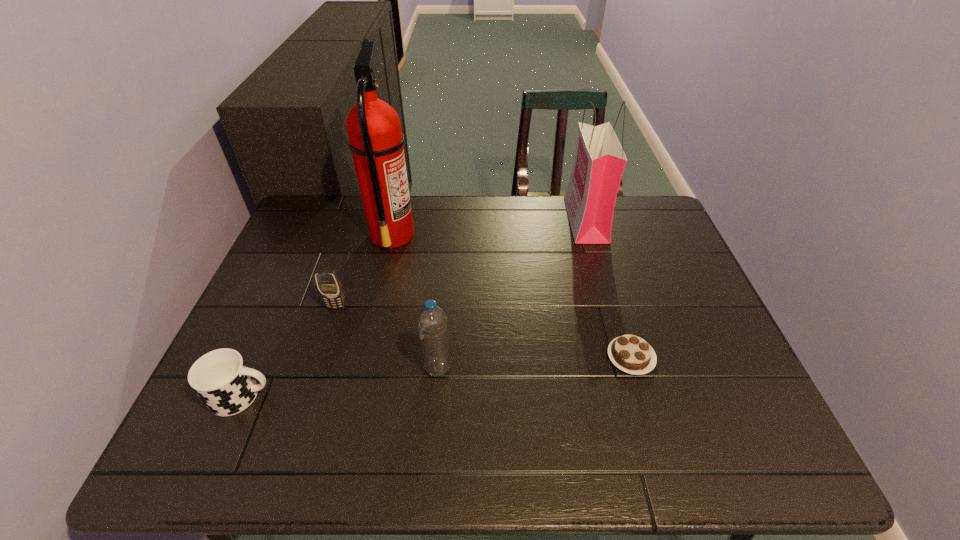
In order to click on object located in the left edge section of the desktop in this screenshot , I will do `click(221, 378)`.

This screenshot has height=540, width=960. What are the coordinates of `blank space at the far edge` in the screenshot? It's located at (572, 239).

The image size is (960, 540). Identify the location of vacant space at the near edge of the desktop. (682, 451).

The height and width of the screenshot is (540, 960). In the image, there is a desktop. Find the location of `vacant space at the left edge`. vacant space at the left edge is located at coordinates (269, 307).

Where is `free space at the right edge`? free space at the right edge is located at coordinates (658, 314).

I want to click on vacant space at the far left corner of the desktop, so pos(336,236).

Locate an element on the screen. vacant space at the far right corner is located at coordinates (638, 212).

Image resolution: width=960 pixels, height=540 pixels. I want to click on vacant area at the near right corner of the desktop, so click(x=735, y=446).

Find the location of a particular element. free space between the fourth tallest object and the fourth shortest object is located at coordinates (387, 338).

Locate an element on the screen. free point between the fourth tallest object and the shortest object is located at coordinates (484, 332).